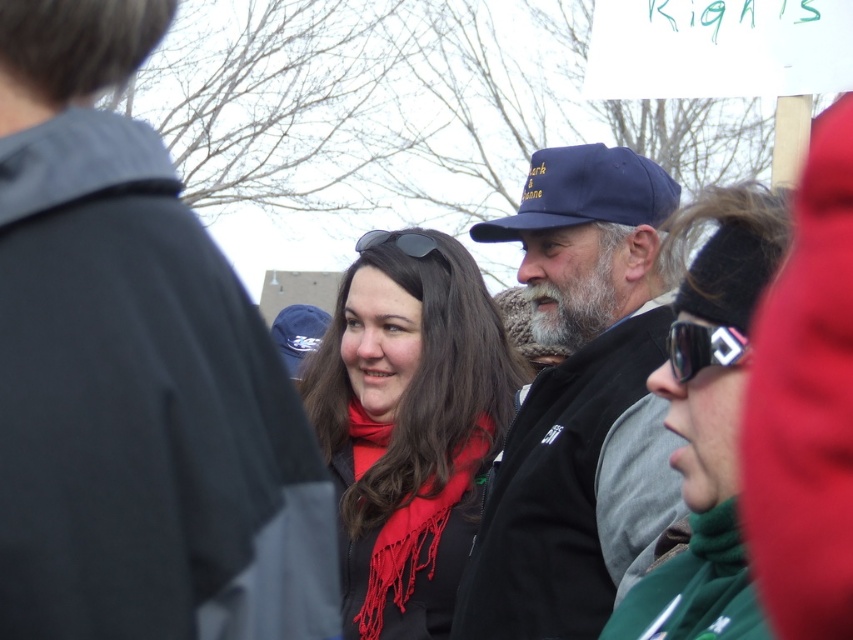
You are a photographer at the event and want to take a photo focusing on the dark blue cap at center and the blue fabric cap at center. Which cap should you adjust your camera focus to first if you want to capture both clearly?

The dark blue cap at center is closer to the viewer than the blue fabric cap at center, so you should focus on the dark blue cap at center first to ensure both are in focus.

What is the color of the cap located at point [135,372] in the image?

The cap at point [135,372] is dark blue.